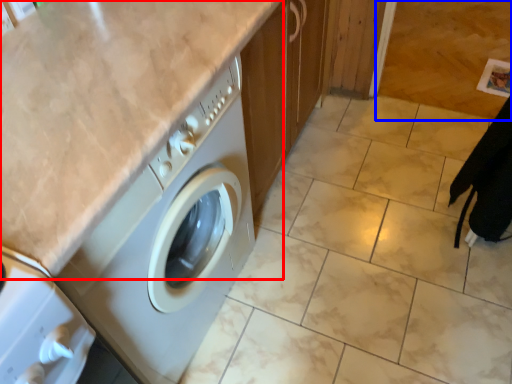
Question: Which object appears farthest to the camera in this image, counter top (highlighted by a red box) or granite (highlighted by a blue box)?

Choices:
 (A) counter top
 (B) granite

Answer: (B)